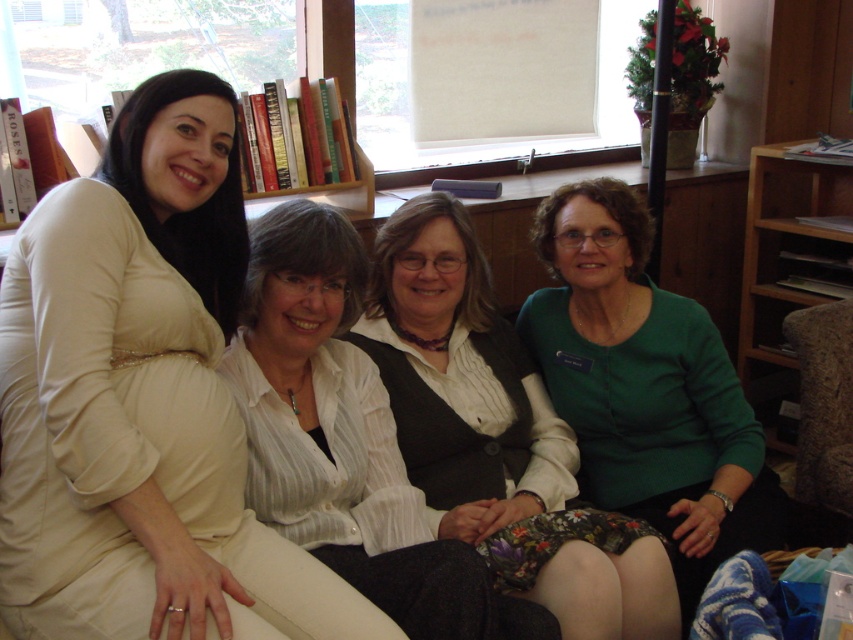
Question: Is green matte sweater at right above brown fabric armchair at right?

Choices:
 (A) yes
 (B) no

Answer: (A)

Question: Is matte white blouse at upper left to the left of white striped shirt at center from the viewer's perspective?

Choices:
 (A) yes
 (B) no

Answer: (A)

Question: Does matte white blouse at upper left appear under green matte sweater at right?

Choices:
 (A) no
 (B) yes

Answer: (A)

Question: Which object appears farthest from the camera in this image?

Choices:
 (A) brown wooden bookshelf at right
 (B) brown fabric armchair at right
 (C) green matte sweater at right
 (D) matte white blouse at upper left

Answer: (A)

Question: Which point is closer to the camera?

Choices:
 (A) (231, 608)
 (B) (790, 200)
 (C) (360, 452)

Answer: (A)

Question: Which point is farther from the camera taking this photo?

Choices:
 (A) (363, 392)
 (B) (158, 232)

Answer: (A)